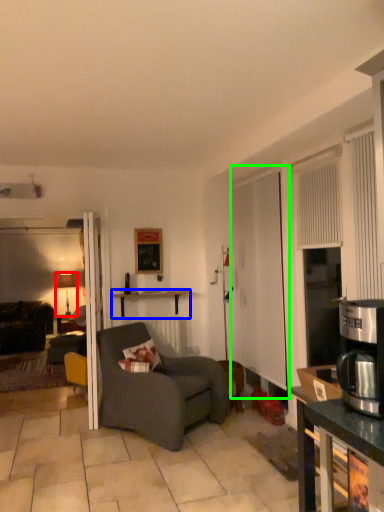
Question: Which object is the farthest from lamp (highlighted by a red box)? Choose among these: desk (highlighted by a blue box) or screen door (highlighted by a green box).

Choices:
 (A) desk
 (B) screen door

Answer: (B)